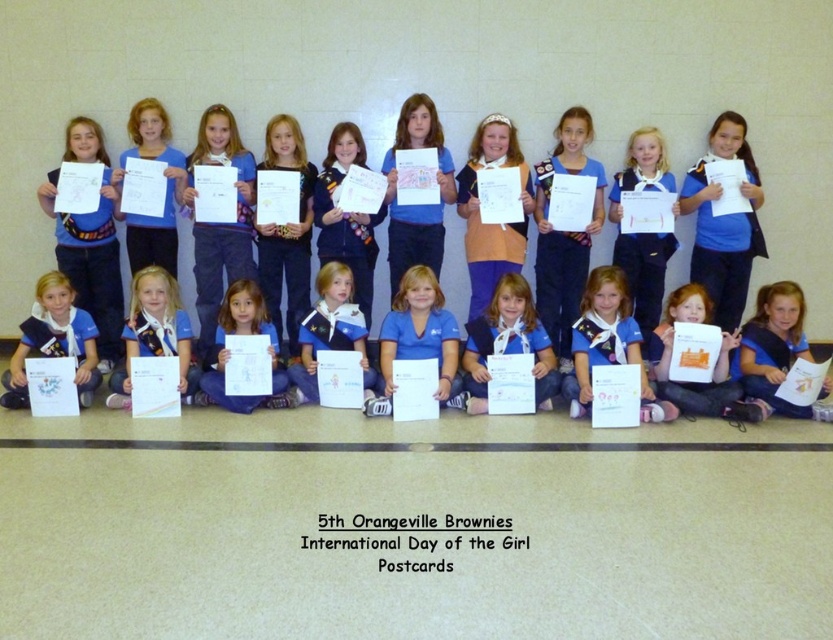
Is blue fabric uniform at center smaller than matte blue uniform at lower left?

Actually, blue fabric uniform at center might be larger than matte blue uniform at lower left.

The width and height of the screenshot is (833, 640). What do you see at coordinates (607, 344) in the screenshot?
I see `blue fabric uniform at center` at bounding box center [607, 344].

Identify the location of blue fabric uniform at center. The height and width of the screenshot is (640, 833). 607,344.